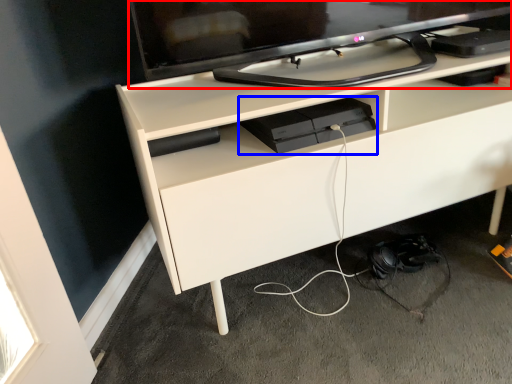
Question: Which object is closer to the camera taking this photo, television (highlighted by a red box) or equipment (highlighted by a blue box)?

Choices:
 (A) television
 (B) equipment

Answer: (A)